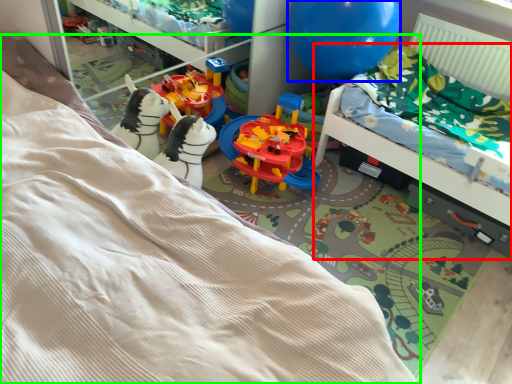
Question: Which is farther away from hospital bed (highlighted by a red box)? balloon (highlighted by a blue box) or bed (highlighted by a green box)?

Choices:
 (A) balloon
 (B) bed

Answer: (B)